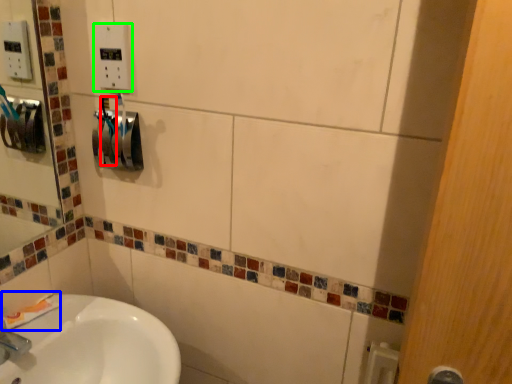
Question: Which is farther away from toothbrush (highlighted by a red box)? toothpaste (highlighted by a blue box) or electric outlet (highlighted by a green box)?

Choices:
 (A) toothpaste
 (B) electric outlet

Answer: (A)